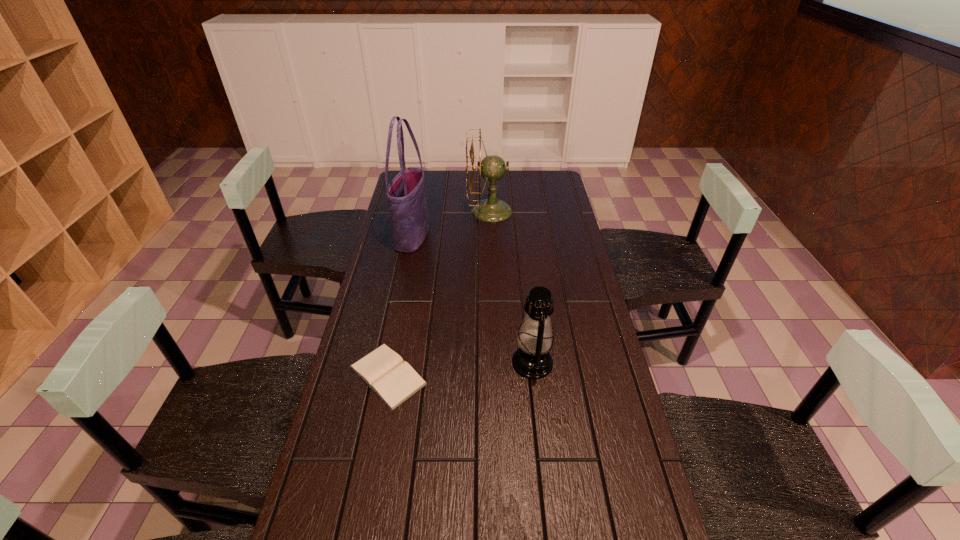
The image size is (960, 540). Find the location of `object that is at the far edge`. object that is at the far edge is located at coordinates (492, 168).

Locate an element on the screen. tote bag that is at the left edge is located at coordinates (405, 194).

At what (x,y) coordinates should I click in order to perform the action: click on Bible located in the left edge section of the desktop. Please return your answer as a coordinate pair (x, y). This screenshot has width=960, height=540. Looking at the image, I should click on pos(383,370).

You are a GUI agent. You are given a task and a screenshot of the screen. Output one action in this format:
    pyautogui.click(x=<x>, y=<y>)
    Task: Click on the vacant space at the far edge
    
    Given the screenshot: What is the action you would take?
    pyautogui.click(x=464, y=180)

The image size is (960, 540). I want to click on free space at the left edge of the desktop, so pos(352,374).

In the image, there is a desktop. Find the location of `vacant space at the right edge`. vacant space at the right edge is located at coordinates (540, 201).

Where is `free space between the third shortest object and the tote bag`? free space between the third shortest object and the tote bag is located at coordinates (451, 224).

At what (x,y) coordinates should I click in order to perform the action: click on free point between the Bible and the third shortest object. Please return your answer as a coordinate pair (x, y). Looking at the image, I should click on (439, 293).

I want to click on vacant area between the third shortest object and the third tallest object, so click(x=511, y=287).

Locate an element on the screen. This screenshot has height=540, width=960. vacant region between the tallest object and the second shortest object is located at coordinates (472, 300).